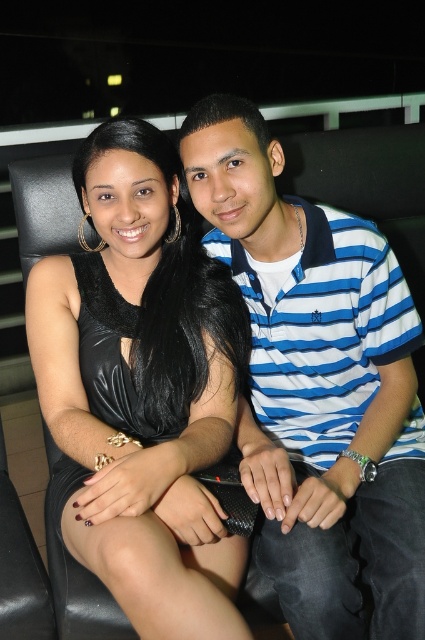
Question: Which point is closer to the camera?

Choices:
 (A) (266, 282)
 (B) (102, 506)

Answer: (B)

Question: Which object is closer to the camera taking this photo?

Choices:
 (A) blue striped polo shirt at center
 (B) black leather dress at center

Answer: (B)

Question: Is blue striped polo shirt at center thinner than black leather dress at center?

Choices:
 (A) no
 (B) yes

Answer: (A)

Question: Which object appears farthest from the camera in this image?

Choices:
 (A) blue striped polo shirt at center
 (B) black leather dress at center

Answer: (A)

Question: Is blue striped polo shirt at center behind black leather dress at center?

Choices:
 (A) yes
 (B) no

Answer: (A)

Question: Is blue striped polo shirt at center positioned behind black leather dress at center?

Choices:
 (A) no
 (B) yes

Answer: (B)